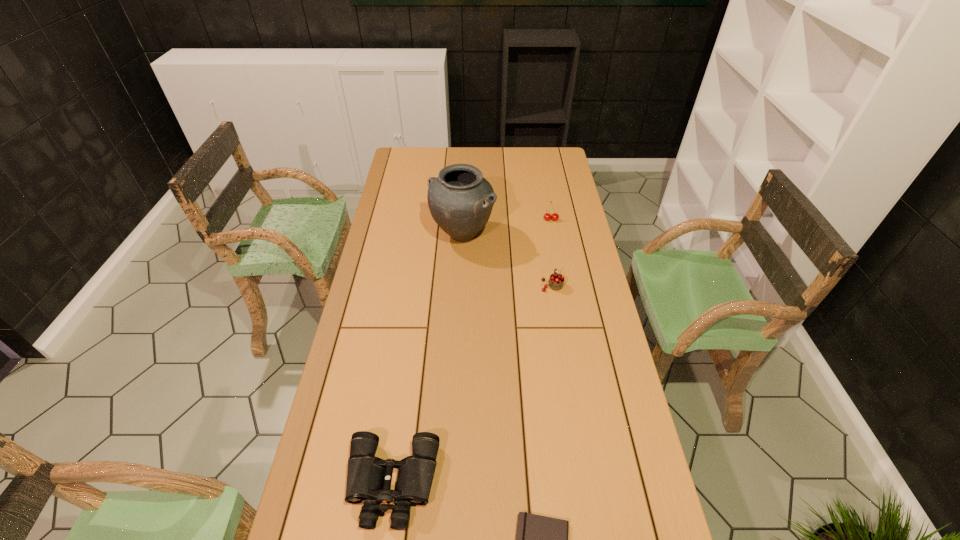
Locate an element on the screen. This screenshot has width=960, height=540. free space at the far edge of the desktop is located at coordinates (457, 156).

At what (x,y) coordinates should I click in order to perform the action: click on vacant point at the left edge. Please return your answer as a coordinate pair (x, y). Looking at the image, I should click on (330, 441).

In the image, there is a desktop. Where is `vacant space at the right edge`? vacant space at the right edge is located at coordinates [594, 350].

Identify the location of free space at the far right corner of the desktop. This screenshot has width=960, height=540. (552, 154).

The image size is (960, 540). I want to click on free area in between the tallest object and the farther cherry, so click(x=507, y=227).

The image size is (960, 540). What are the coordinates of `free area in between the third nearest object and the farther cherry` in the screenshot? It's located at (551, 252).

What are the coordinates of `vacant area that lies between the binoculars and the third nearest object` in the screenshot? It's located at tap(472, 384).

This screenshot has height=540, width=960. Find the location of `vacant space that's between the third farthest object and the urn`. vacant space that's between the third farthest object and the urn is located at coordinates 508,259.

The width and height of the screenshot is (960, 540). I want to click on vacant space that is in between the tallest object and the binoculars, so click(x=427, y=359).

Identify the location of empty space that is in between the third farthest object and the binoculars. (472, 384).